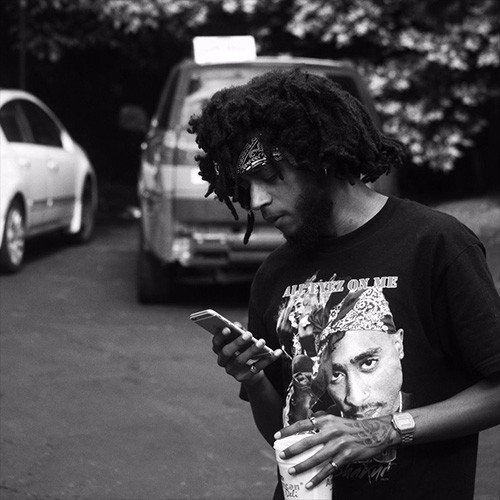
I want to click on phone, so click(x=212, y=324).